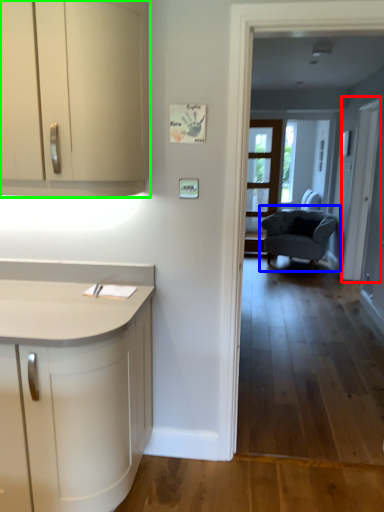
Question: Estimate the real-world distances between objects in this image. Which object is closer to screen door (highlighted by a red box), chair (highlighted by a blue box) or cabinetry (highlighted by a green box)?

Choices:
 (A) chair
 (B) cabinetry

Answer: (A)